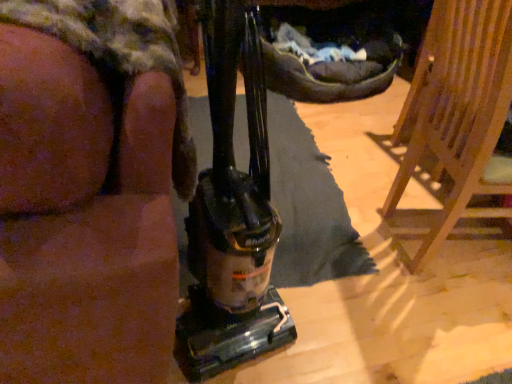
At what (x,y) coordinates should I click in order to perform the action: click on vacant space in front of wooden chair at right. Please return your answer as a coordinate pair (x, y). The image size is (512, 384). Looking at the image, I should click on (451, 325).